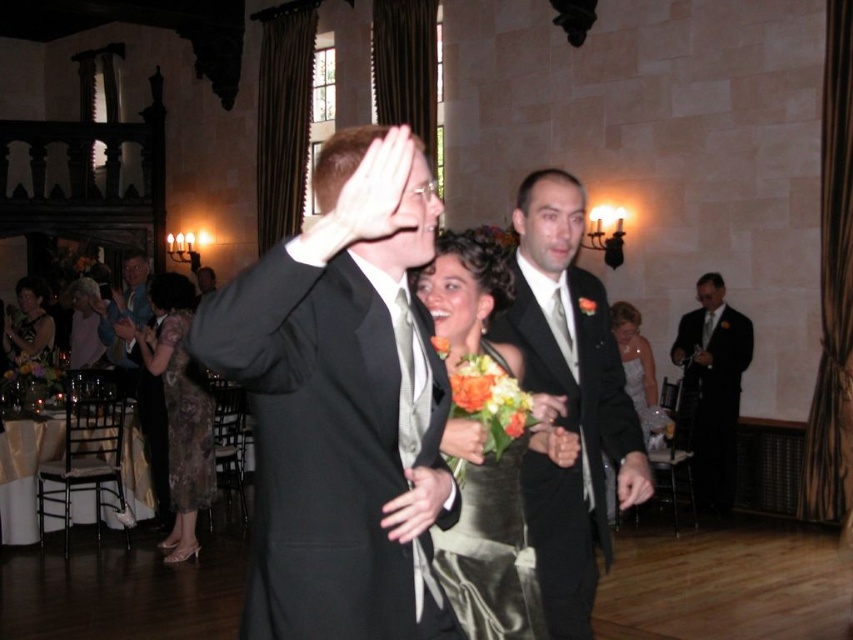
Can you confirm if printed silk dress at left is thinner than light blue suit at left?

No.

Can you confirm if printed silk dress at left is wider than light blue suit at left?

Correct, the width of printed silk dress at left exceeds that of light blue suit at left.

Who is more forward, (202, 372) or (114, 326)?

Point (202, 372) is in front.

Locate an element on the screen. Image resolution: width=853 pixels, height=640 pixels. printed silk dress at left is located at coordinates (180, 410).

Can you confirm if light blue suit at left is taller than white satin dress at lower right?

Yes.

Is point (137, 305) farther from viewer compared to point (656, 394)?

Yes, it is behind point (656, 394).

The image size is (853, 640). Find the location of `light blue suit at left`. light blue suit at left is located at coordinates (138, 371).

Is shiny black suit at center below light blue suit at left?

Actually, shiny black suit at center is above light blue suit at left.

Which is in front, point (576, 499) or point (152, 412)?

Point (576, 499) is in front.

Does point (573, 321) come closer to viewer compared to point (149, 301)?

Yes, point (573, 321) is in front of point (149, 301).

Find the location of `shiny black suit at center`. shiny black suit at center is located at coordinates (567, 400).